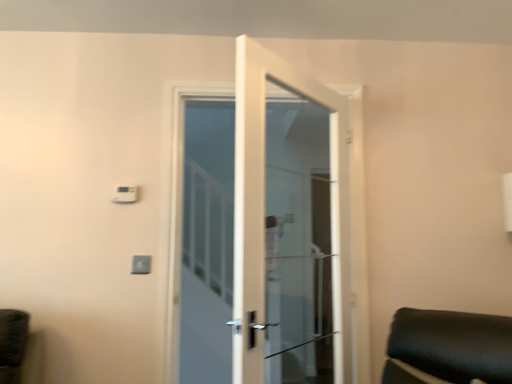
Describe the element at coordinates (141, 264) in the screenshot. I see `white plastic light switch at upper center, acting as the 1th light switch starting from the right` at that location.

Describe the element at coordinates (125, 194) in the screenshot. Image resolution: width=512 pixels, height=384 pixels. I see `white plastic light switch at upper center, positioned as the first light switch in left-to-right order` at that location.

Measure the distance between white glass door at center and camera.

They are 2.64 meters apart.

In order to click on white plastic light switch at upper center, acting as the 1th light switch starting from the right in this screenshot , I will do `click(141, 264)`.

Considering the relative positions of white glass door at center and white plastic light switch at upper center, acting as the 1th light switch starting from the right, in the image provided, is white glass door at center to the right of white plastic light switch at upper center, acting as the 1th light switch starting from the right, from the viewer's perspective?

Correct, you'll find white glass door at center to the right of white plastic light switch at upper center, acting as the 1th light switch starting from the right.

Who is smaller, white glass door at center or white plastic light switch at upper center, acting as the 1th light switch starting from the right?

With smaller size is white plastic light switch at upper center, acting as the 1th light switch starting from the right.

From the image's perspective, relative to white plastic light switch at upper center, acting as the 1th light switch starting from the right, is white glass door at center above or below?

white glass door at center is above white plastic light switch at upper center, acting as the 1th light switch starting from the right.

From a real-world perspective, is white glass door at center positioned over white plastic light switch at upper center, the 2th light switch in the top-to-bottom sequence, based on gravity?

Correct, in the physical world, white glass door at center is higher than white plastic light switch at upper center, the 2th light switch in the top-to-bottom sequence.

Could you tell me if white plastic light switch at upper center, which ranks as the second light switch in right-to-left order, is turned towards white plastic light switch at upper center, which is the 1th light switch from bottom to top?

No, white plastic light switch at upper center, which ranks as the second light switch in right-to-left order, is not oriented towards white plastic light switch at upper center, which is the 1th light switch from bottom to top.

Is white plastic light switch at upper center, positioned as the first light switch in left-to-right order, taller or shorter than white plastic light switch at upper center, the 2th light switch in the top-to-bottom sequence?

Considering their sizes, white plastic light switch at upper center, positioned as the first light switch in left-to-right order, has more height than white plastic light switch at upper center, the 2th light switch in the top-to-bottom sequence.

Considering the positions of objects white plastic light switch at upper center, the second light switch in the bottom-to-top sequence, and white plastic light switch at upper center, which is the 1th light switch from bottom to top, in the image provided, who is more to the right, white plastic light switch at upper center, the second light switch in the bottom-to-top sequence, or white plastic light switch at upper center, which is the 1th light switch from bottom to top,?

Positioned to the right is white plastic light switch at upper center, which is the 1th light switch from bottom to top.

Is the surface of white plastic light switch at upper center, which appears as the 1th light switch when viewed from the top, in direct contact with white plastic light switch at upper center, which appears as the second light switch when viewed from the left?

No, white plastic light switch at upper center, which appears as the 1th light switch when viewed from the top, is not touching white plastic light switch at upper center, which appears as the second light switch when viewed from the left.

Is white plastic light switch at upper center, the 2th light switch in the top-to-bottom sequence, turned away from white plastic light switch at upper center, positioned as the first light switch in left-to-right order?

No, white plastic light switch at upper center, the 2th light switch in the top-to-bottom sequence, is not facing away from white plastic light switch at upper center, positioned as the first light switch in left-to-right order.

How many degrees apart are the facing directions of white plastic light switch at upper center, the 2th light switch in the top-to-bottom sequence, and white plastic light switch at upper center, the second light switch in the bottom-to-top sequence?

The facing directions of white plastic light switch at upper center, the 2th light switch in the top-to-bottom sequence, and white plastic light switch at upper center, the second light switch in the bottom-to-top sequence, are 0.00201 degrees apart.

How distant is white plastic light switch at upper center, which is the 1th light switch from bottom to top, from white plastic light switch at upper center, which appears as the 1th light switch when viewed from the top?

The distance of white plastic light switch at upper center, which is the 1th light switch from bottom to top, from white plastic light switch at upper center, which appears as the 1th light switch when viewed from the top, is 11.78 inches.

Does point (138, 260) appear closer or farther from the camera than point (115, 202)?

Point (138, 260) appears to be closer to the viewer than point (115, 202).

Is white glass door at center turned away from white plastic light switch at upper center, the second light switch in the bottom-to-top sequence?

That's not correct — white glass door at center is not looking away from white plastic light switch at upper center, the second light switch in the bottom-to-top sequence.

Looking at the image, does white glass door at center seem bigger or smaller compared to white plastic light switch at upper center, which appears as the 1th light switch when viewed from the top?

white glass door at center is bigger than white plastic light switch at upper center, which appears as the 1th light switch when viewed from the top.

From the image's perspective, which object appears higher, white glass door at center or white plastic light switch at upper center, positioned as the first light switch in left-to-right order?

white plastic light switch at upper center, positioned as the first light switch in left-to-right order.

Find the location of a particular element. Image resolution: width=512 pixels, height=384 pixels. the 2nd light switch to the left of the white glass door at center, counting from the anchor's position is located at coordinates (125, 194).

Is white plastic light switch at upper center, which ranks as the second light switch in right-to-left order, positioned with its back to white glass door at center?

white plastic light switch at upper center, which ranks as the second light switch in right-to-left order, is not turned away from white glass door at center.

Considering the positions of point (136, 192) and point (223, 170), is point (136, 192) closer or farther from the camera than point (223, 170)?

Point (136, 192) appears to be closer to the viewer than point (223, 170).

Considering the sizes of objects white plastic light switch at upper center, which ranks as the second light switch in right-to-left order, and white glass door at center in the image provided, who is thinner, white plastic light switch at upper center, which ranks as the second light switch in right-to-left order, or white glass door at center?

With smaller width is white plastic light switch at upper center, which ranks as the second light switch in right-to-left order.

Which is more to the left, white plastic light switch at upper center, positioned as the first light switch in left-to-right order, or white glass door at center?

From the viewer's perspective, white plastic light switch at upper center, positioned as the first light switch in left-to-right order, appears more on the left side.

This screenshot has width=512, height=384. What are the coordinates of `light switch below the white glass door at center (from a real-world perspective)` in the screenshot? It's located at (141, 264).

From the image's perspective, is white plastic light switch at upper center, which is the 1th light switch from bottom to top, located above or below white glass door at center?

From the image's perspective, white plastic light switch at upper center, which is the 1th light switch from bottom to top, appears below white glass door at center.

From a real-world perspective, which is physically above, white plastic light switch at upper center, acting as the 1th light switch starting from the right, or white glass door at center?

white glass door at center.

Considering their positions, is white plastic light switch at upper center, acting as the 1th light switch starting from the right, located in front of or behind white glass door at center?

In the image, white plastic light switch at upper center, acting as the 1th light switch starting from the right, appears behind white glass door at center.

Identify the location of light switch that is under the white glass door at center (from a real-world perspective). This screenshot has width=512, height=384. (141, 264).

At what (x,y) coordinates should I click in order to perform the action: click on light switch below the white plastic light switch at upper center, the second light switch in the bottom-to-top sequence (from the image's perspective). Please return your answer as a coordinate pair (x, y). Image resolution: width=512 pixels, height=384 pixels. Looking at the image, I should click on (141, 264).

Estimate the real-world distances between objects in this image. Which object is further from white plastic light switch at upper center, which appears as the 1th light switch when viewed from the top, white glass door at center or white plastic light switch at upper center, which appears as the second light switch when viewed from the left?

white glass door at center is further to white plastic light switch at upper center, which appears as the 1th light switch when viewed from the top.

Which object lies further to the anchor point white plastic light switch at upper center, the 2th light switch in the top-to-bottom sequence, white plastic light switch at upper center, positioned as the first light switch in left-to-right order, or white glass door at center?

Among the two, white glass door at center is located further to white plastic light switch at upper center, the 2th light switch in the top-to-bottom sequence.

Which object lies further to the anchor point white plastic light switch at upper center, acting as the 1th light switch starting from the right, white glass door at center or white plastic light switch at upper center, the second light switch in the bottom-to-top sequence?

white glass door at center lies further to white plastic light switch at upper center, acting as the 1th light switch starting from the right, than the other object.

When comparing their distances from white plastic light switch at upper center, which appears as the 1th light switch when viewed from the top, does white plastic light switch at upper center, acting as the 1th light switch starting from the right, or white glass door at center seem further?

The object further to white plastic light switch at upper center, which appears as the 1th light switch when viewed from the top, is white glass door at center.

From the image, which object appears to be farther from white glass door at center, white plastic light switch at upper center, acting as the 1th light switch starting from the right, or white plastic light switch at upper center, which appears as the 1th light switch when viewed from the top?

white plastic light switch at upper center, which appears as the 1th light switch when viewed from the top, lies further to white glass door at center than the other object.

Considering their positions, is white plastic light switch at upper center, which appears as the 1th light switch when viewed from the top, positioned further to white glass door at center than white plastic light switch at upper center, which is the 1th light switch from bottom to top?

white plastic light switch at upper center, which appears as the 1th light switch when viewed from the top, is further to white glass door at center.

In order to click on light switch between white plastic light switch at upper center, the second light switch in the bottom-to-top sequence, and white glass door at center from left to right in this screenshot , I will do `click(141, 264)`.